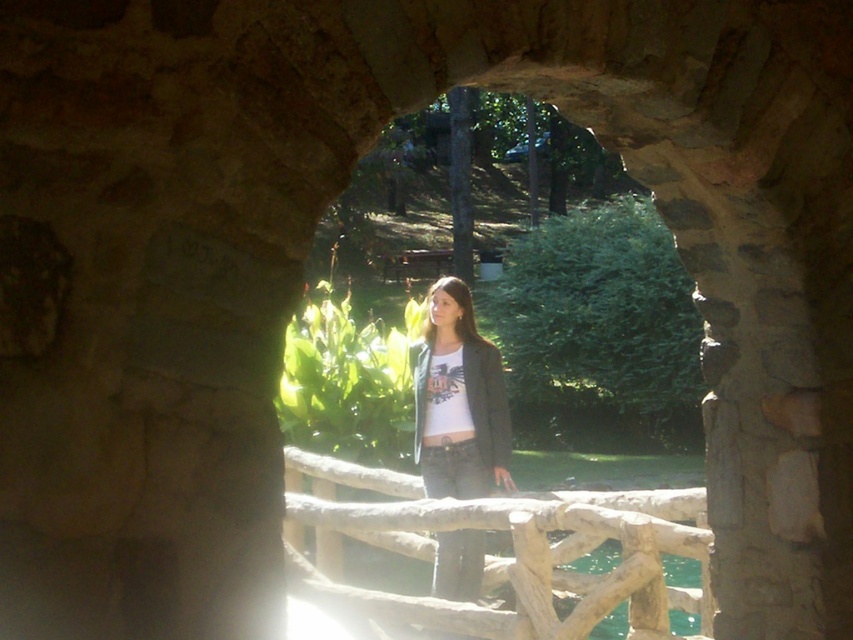
You are standing in front of the stone archway and see the wooden at center and the matte black jacket at center. Which object is larger in size?

The wooden at center is bigger than the matte black jacket at center, so the wooden at center is larger in size.

In the scene shown: You are standing in front of the stone archway and see two points marked on the ground. The first point is at coordinate point(660, 609) and the second is at point(438, 298). Which point is closer to you?

Point(660, 609) is in front of point(438, 298), so the first point is closer to you.

Based on the photo, you are standing in front of the stone archway and want to place a 24 inch long object between the wooden at center and the matte black jacket at center. Is there enough space?

The wooden at center is 25.52 inches away from the matte black jacket at center, so yes, there is enough space to place a 24 inch long object between them since the distance is greater than the object length.